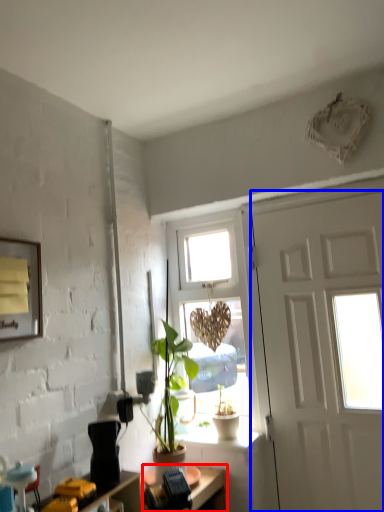
Question: Among these objects, which one is nearest to the camera, desk (highlighted by a red box) or door (highlighted by a blue box)?

Choices:
 (A) desk
 (B) door

Answer: (A)